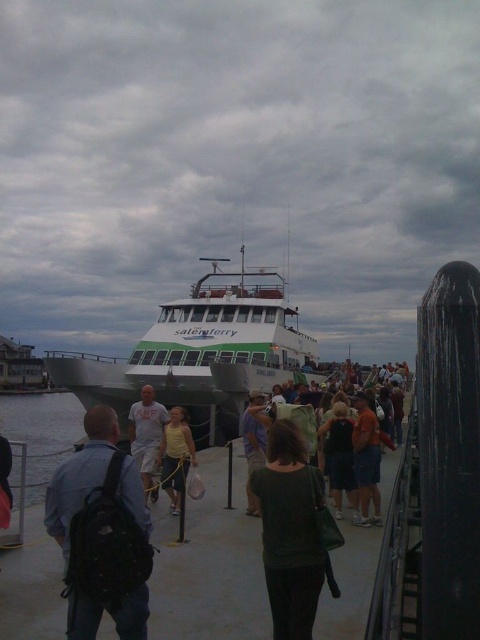
You are standing on the ferry dock and see the dark green fabric at center and the clear water at lower left. Which object is closer to your right side?

The dark green fabric at center is to the right of clear water at lower left, so it is closer to your right side.

Based on the photo, you are standing at the ferry dock and notice two groups near the center. One is a dark gray fabric crowd at center and the other is a yellow cotton shirt at center. Which group is positioned more to the east side of the dock?

The yellow cotton shirt at center is positioned more to the east side of the dock because the dark gray fabric crowd at center is to the right of it, implying the shirt is to the west, so the crowd is east. Wait, no, if the crowd is to the right of the shirt, then the shirt is to the left of the crowd. Since left is typically east if facing the ferry, but direction depends on perspective. Hmm, maybe better to use the description directly. The description says dark gray fabric crowd at center is to the right

You are standing at the ferry dock and see the matte black backpack at center. If you move 0.1 units to the right and 0.05 units forward, will you be closer to the backpack?

Moving 0.1 units to the right and 0.05 units forward would place you at coordinates approximately 0.933 units right and 0.262 units forward. Since the backpack is at 0.833 right and 0.212 forward, this movement would actually increase the distance from the backpack. Therefore, you would not be closer.